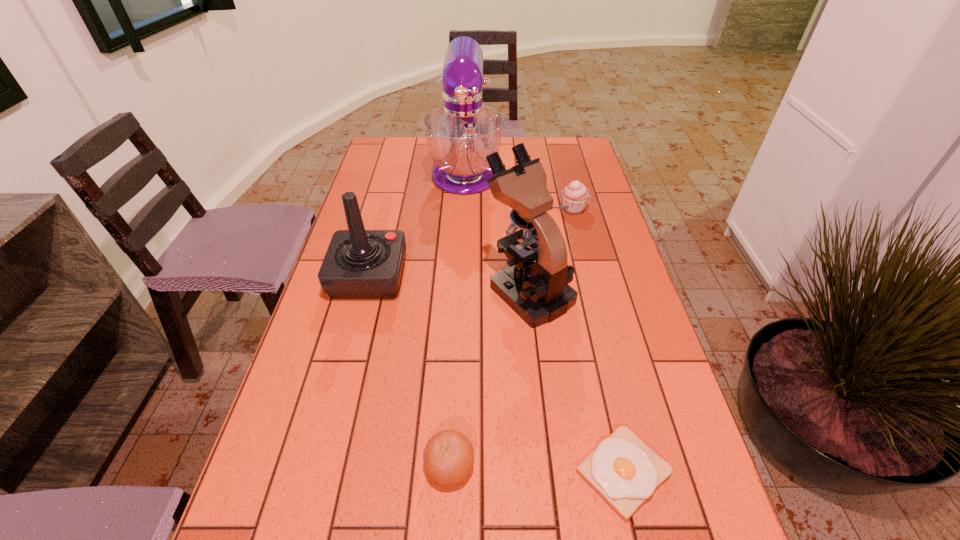
Locate an element on the screen. The width and height of the screenshot is (960, 540). vacant space at the far left corner is located at coordinates (396, 139).

Locate an element on the screen. Image resolution: width=960 pixels, height=540 pixels. free space between the third tallest object and the toast is located at coordinates (496, 374).

You are a GUI agent. You are given a task and a screenshot of the screen. Output one action in this format:
    pyautogui.click(x=<x>, y=<y>)
    Task: Click on the vacant point located between the second shortest object and the shortest object
    
    Given the screenshot: What is the action you would take?
    pyautogui.click(x=537, y=469)

Where is `free space between the toast and the cupcake`? free space between the toast and the cupcake is located at coordinates pos(598,341).

The image size is (960, 540). Find the location of `free space between the microscope and the mixer`. free space between the microscope and the mixer is located at coordinates [x=497, y=229].

At what (x,y) coordinates should I click in order to perform the action: click on vacant space that's between the shortest object and the microscope. Please return your answer as a coordinate pair (x, y). Image resolution: width=960 pixels, height=540 pixels. Looking at the image, I should click on (576, 381).

Find the location of a particular element. The width and height of the screenshot is (960, 540). unoccupied area between the mixer and the fifth tallest object is located at coordinates (458, 316).

At what (x,y) coordinates should I click in order to perform the action: click on free space between the microscope and the mixer. Please return your answer as a coordinate pair (x, y). This screenshot has height=540, width=960. Looking at the image, I should click on [497, 229].

The height and width of the screenshot is (540, 960). I want to click on vacant space that is in between the toast and the microscope, so click(576, 381).

Select which object appears as the fourth closest to the microscope. Please provide its 2D coordinates. Your answer should be formatted as a tuple, i.e. [(x, y)], where the tuple contains the x and y coordinates of a point satisfying the conditions above.

[(460, 134)]